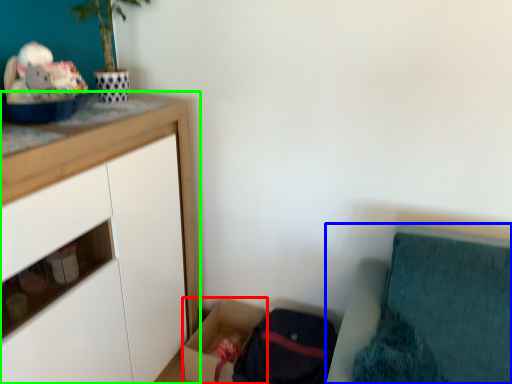
Question: Estimate the real-world distances between objects in this image. Which object is farther from storage box (highlighted by a red box), furniture (highlighted by a blue box) or cabinetry (highlighted by a green box)?

Choices:
 (A) furniture
 (B) cabinetry

Answer: (A)